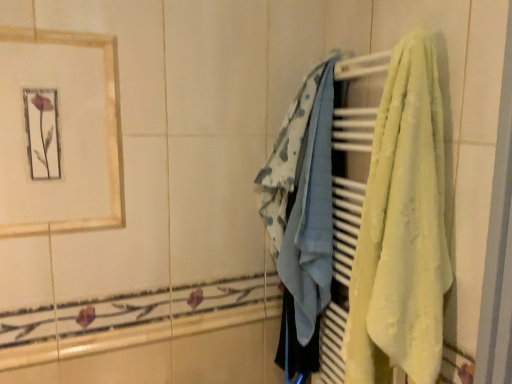
Question: From a real-world perspective, is light blue fabric at center, which ranks as the 1th towel in back-to-front order, under yellow soft towel at right, placed as the second towel when sorted from back to front?

Choices:
 (A) no
 (B) yes

Answer: (A)

Question: Is light blue fabric at center, which is the second towel from right to left, taller than yellow soft towel at right, placed as the second towel when sorted from back to front?

Choices:
 (A) yes
 (B) no

Answer: (B)

Question: From the image's perspective, would you say light blue fabric at center, which is the second towel from right to left, is shown under yellow soft towel at right, which is counted as the second towel, starting from the left?

Choices:
 (A) yes
 (B) no

Answer: (B)

Question: Does light blue fabric at center, which is the second towel from right to left, have a lesser width compared to yellow soft towel at right, the 1th towel in the right-to-left sequence?

Choices:
 (A) yes
 (B) no

Answer: (B)

Question: Is there a large distance between light blue fabric at center, the second towel in the front-to-back sequence, and yellow soft towel at right, placed as the second towel when sorted from back to front?

Choices:
 (A) yes
 (B) no

Answer: (B)

Question: Is light blue fabric at center, which ranks as the 1th towel in back-to-front order, further to camera compared to yellow soft towel at right, the 1th towel in the right-to-left sequence?

Choices:
 (A) no
 (B) yes

Answer: (B)

Question: From a real-world perspective, is yellow soft towel at right, which appears as the first towel when viewed from the front, physically below gold-framed picture at upper left?

Choices:
 (A) no
 (B) yes

Answer: (B)

Question: Is yellow soft towel at right, placed as the second towel when sorted from back to front, to the right of gold-framed picture at upper left from the viewer's perspective?

Choices:
 (A) yes
 (B) no

Answer: (A)

Question: Would you say yellow soft towel at right, placed as the second towel when sorted from back to front, is outside gold-framed picture at upper left?

Choices:
 (A) yes
 (B) no

Answer: (A)

Question: Does yellow soft towel at right, which is counted as the second towel, starting from the left, appear on the left side of gold-framed picture at upper left?

Choices:
 (A) no
 (B) yes

Answer: (A)

Question: From the image's perspective, does yellow soft towel at right, placed as the second towel when sorted from back to front, appear higher than gold-framed picture at upper left?

Choices:
 (A) no
 (B) yes

Answer: (A)

Question: Is yellow soft towel at right, which is counted as the second towel, starting from the left, positioned far away from gold-framed picture at upper left?

Choices:
 (A) yes
 (B) no

Answer: (B)

Question: Can you confirm if gold-framed picture at upper left is bigger than yellow soft towel at right, which appears as the first towel when viewed from the front?

Choices:
 (A) yes
 (B) no

Answer: (B)